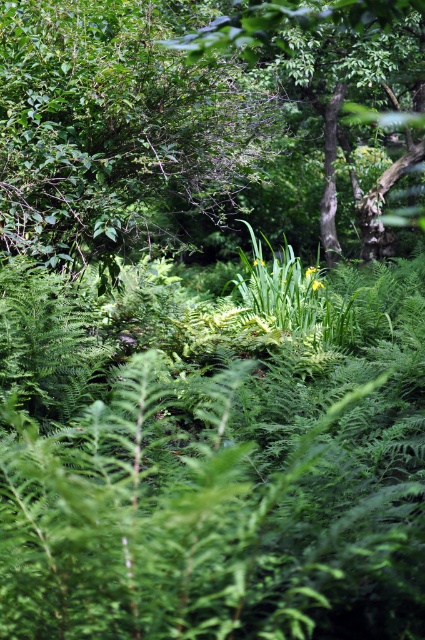
You are standing in the forest and want to move from point A to point B. Point A is at coordinate point (27, 131) and point B is at coordinate point (325, 154). Which point is closer to you?

Point A at coordinate point (27, 131) is closer to you than point B at coordinate point (325, 154).

You are a hiker who wants to take a photo of the green leafy tree at upper center and the green leafy tree at center. Which tree should you move closer to in order to capture both trees in the frame without zooming in?

You should move closer to the green leafy tree at upper center because it has a smaller width than the green leafy tree at center, allowing both to fit in the frame when positioned nearer to the narrower tree.